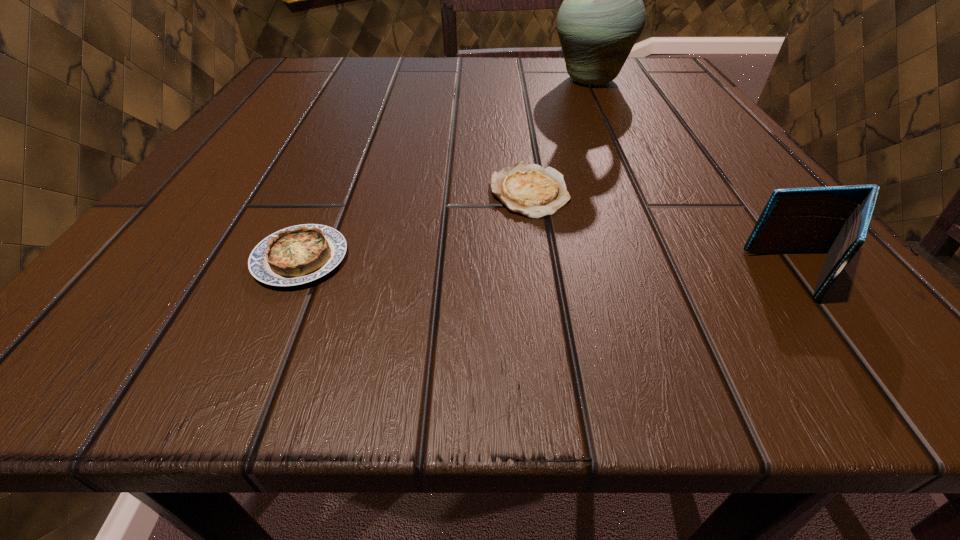
This screenshot has width=960, height=540. I want to click on object present at the near left corner, so click(300, 254).

Locate an element on the screen. This screenshot has width=960, height=540. object that is at the far right corner is located at coordinates (602, 16).

Identify the location of object located at the near right corner. (835, 220).

In the image, there is a desktop. Where is `vacant region at the far edge`? The height and width of the screenshot is (540, 960). vacant region at the far edge is located at coordinates (425, 103).

Locate an element on the screen. The width and height of the screenshot is (960, 540). free space at the near edge of the desktop is located at coordinates (648, 322).

Find the location of a particular element. Image resolution: width=960 pixels, height=540 pixels. blank space at the left edge of the desktop is located at coordinates (226, 150).

Find the location of `free space at the right edge of the desktop`. free space at the right edge of the desktop is located at coordinates (805, 258).

Where is `vacant point at the far left corner`? The image size is (960, 540). vacant point at the far left corner is located at coordinates (341, 80).

At what (x,y) coordinates should I click in order to perform the action: click on free space at the far right corner of the desktop. Please return your answer as a coordinate pair (x, y). Looking at the image, I should click on (650, 97).

Locate an element on the screen. This screenshot has height=540, width=960. vacant space at the near right corner of the desktop is located at coordinates (801, 300).